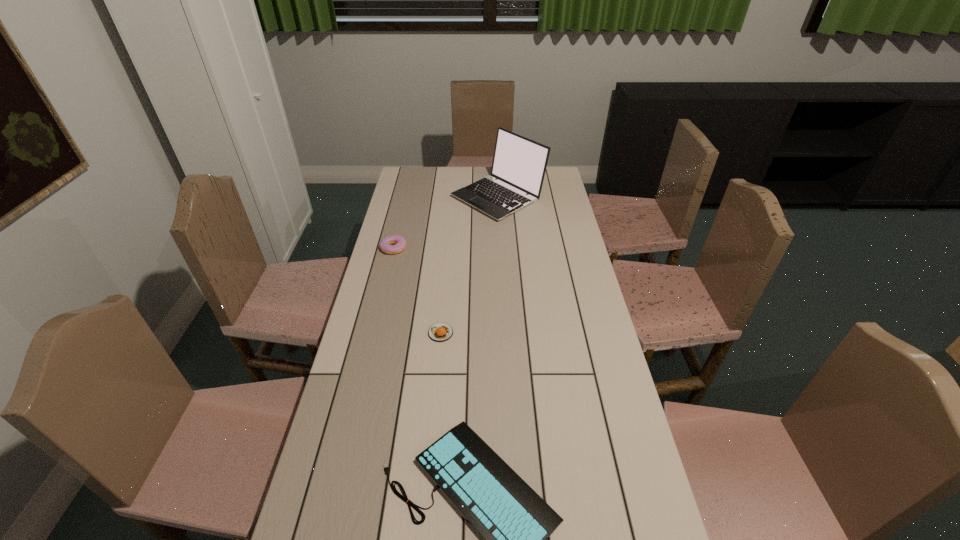
Find the location of a particular element. The height and width of the screenshot is (540, 960). blank space located 0.090m on the right of the third tallest object is located at coordinates (481, 333).

You are a GUI agent. You are given a task and a screenshot of the screen. Output one action in this format:
    pyautogui.click(x=<x>, y=<y>)
    Task: Click on the object that is at the far edge
    The image size is (960, 540).
    Given the screenshot: What is the action you would take?
    pos(519,164)

This screenshot has height=540, width=960. What are the coordinates of `object at the left edge` in the screenshot? It's located at (400, 243).

At what (x,y) coordinates should I click in order to perform the action: click on object that is at the right edge. Please return your answer as a coordinate pair (x, y). Looking at the image, I should click on (519, 164).

Locate an element on the screen. object present at the far right corner is located at coordinates (519, 164).

The height and width of the screenshot is (540, 960). In the image, there is a desktop. In order to click on free space at the far edge in this screenshot , I will do `click(451, 171)`.

The image size is (960, 540). I want to click on vacant space at the left edge of the desktop, so click(x=392, y=258).

In order to click on free region at the right edge of the desktop in this screenshot , I will do coord(596,300).

The height and width of the screenshot is (540, 960). In order to click on vacant space at the far right corner of the desktop in this screenshot , I will do `click(553, 173)`.

You are a GUI agent. You are given a task and a screenshot of the screen. Output one action in this format:
    pyautogui.click(x=<x>, y=<y>)
    Task: Click on the free space between the tallest object and the third farthest object
    
    Given the screenshot: What is the action you would take?
    pyautogui.click(x=469, y=265)